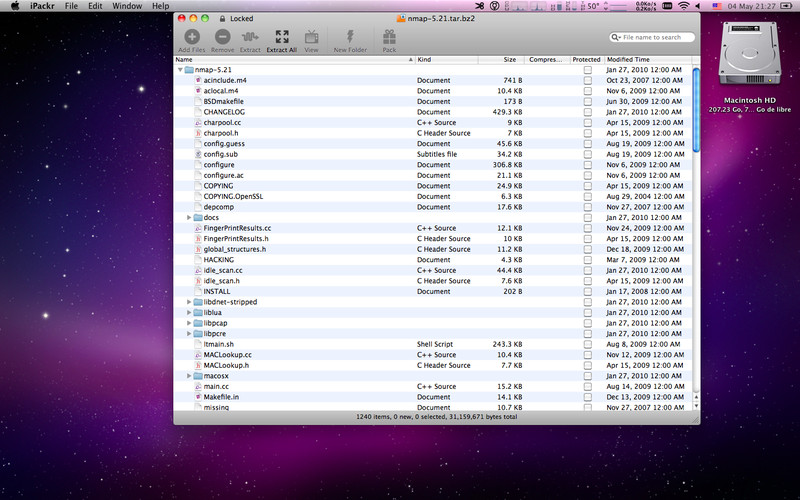
Where is `folders`? The height and width of the screenshot is (500, 800). folders is located at coordinates (190, 69), (201, 216), (201, 300), (197, 312), (202, 324), (198, 336), (200, 378).